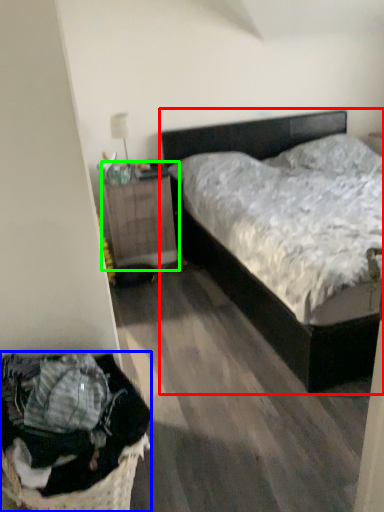
Question: Which object is the closest to the bed (highlighted by a red box)? Choose among these: laundry basket (highlighted by a blue box) or nightstand (highlighted by a green box).

Choices:
 (A) laundry basket
 (B) nightstand

Answer: (B)